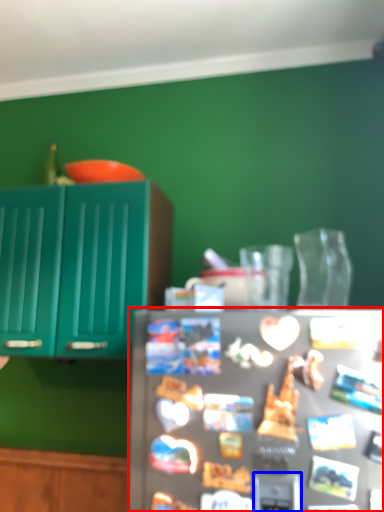
Question: Which of the following is the closest to the observer, refrigerator (highlighted by a red box) or appliance (highlighted by a blue box)?

Choices:
 (A) refrigerator
 (B) appliance

Answer: (A)